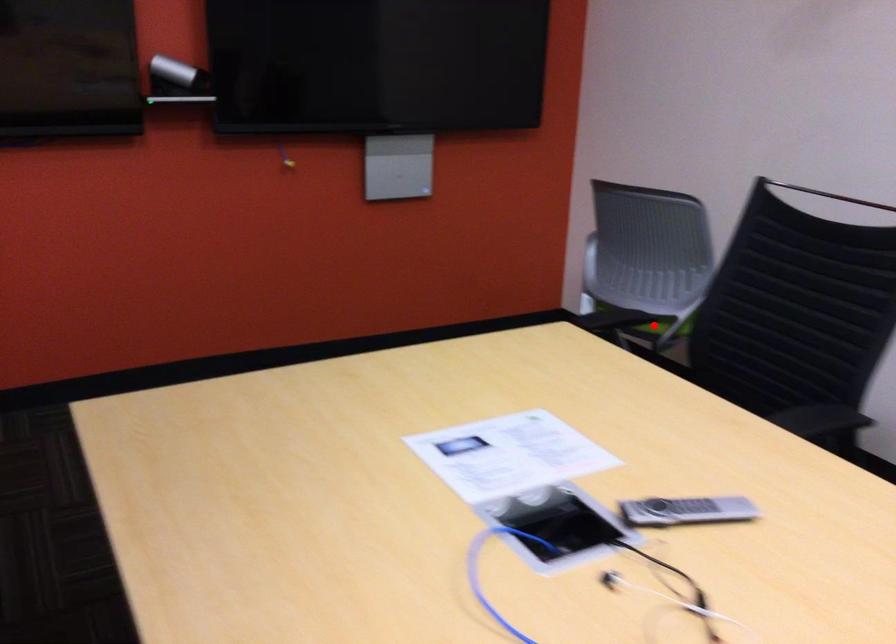
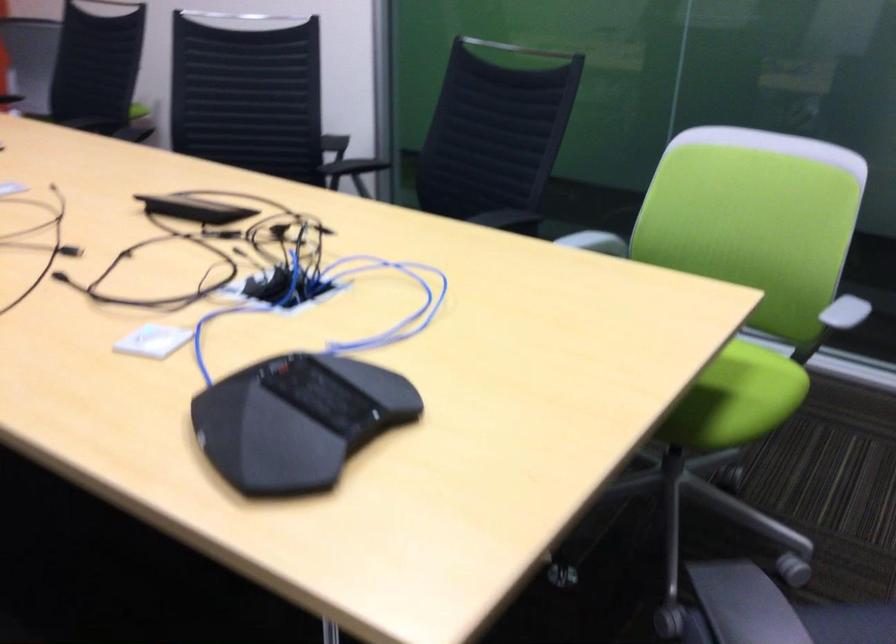
Question: I am providing you with two images of the same scene from different viewpoints. A red point is marked on the first image. At the location where the point appears in image 1, is it still visible in image 2?

Choices:
 (A) Yes
 (B) No

Answer: (B)